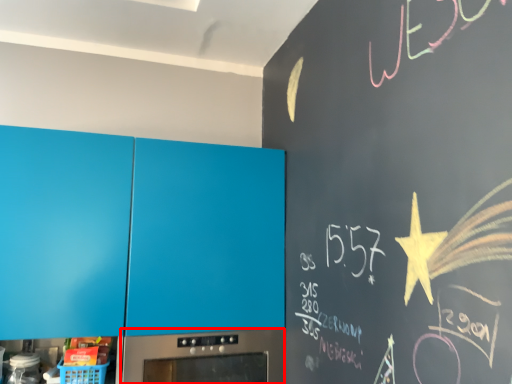
Question: From the image's perspective, where is home appliance (annotated by the red box) located in relation to cabinetry in the image?

Choices:
 (A) above
 (B) below

Answer: (B)